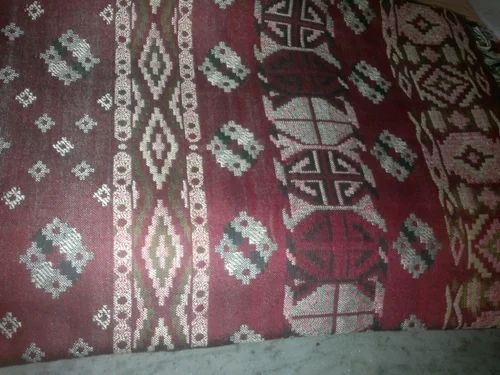
Where is `light red background of blanket`? light red background of blanket is located at coordinates (54, 310).